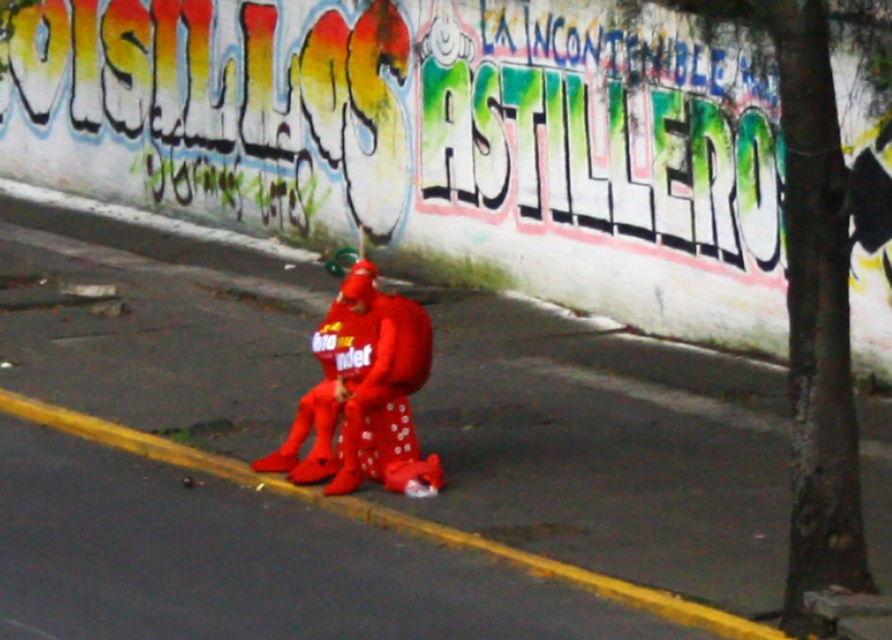
You are a delivery robot with a 6.5 feet long package. You need to place the package between the matte red pavement at center and the matte red costume at center. Is there enough space to fit the package without overlapping either object?

The distance between the matte red pavement at center and the matte red costume at center is 7.28 feet. Since the package is 6.5 feet long, there is enough space to fit it without overlapping either object.

You are a delivery drone flying over an urban area. You need to land on the matte red pavement at center. According to the coordinates provided, where should you aim to land?

You should aim to land at point (x=606, y=448) as the matte red pavement at center is located there.

You are standing at the point marked by the coordinates point [606,448]. What color is the material under your feet?

The material under your feet at point [606,448] is matte red pavement.